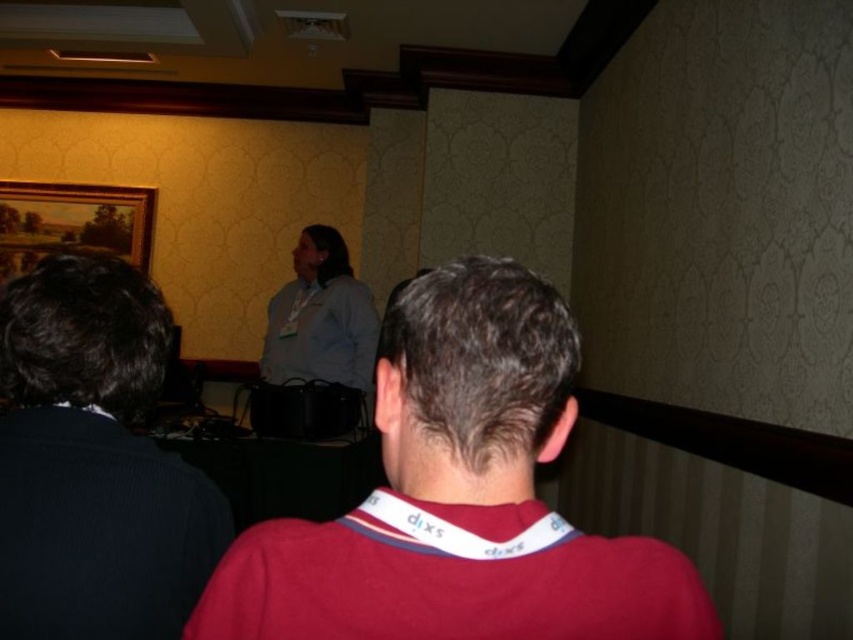
What do you see at coordinates (94, 461) in the screenshot? I see `dark blue sweater at left` at bounding box center [94, 461].

Consider the image. Measure the distance between point (103,260) and camera.

1.04 meters

Find the location of a particular element. This screenshot has width=853, height=640. dark blue sweater at left is located at coordinates (94, 461).

Does red cotton shirt at center appear on the right side of wooden oil painting at upper left?

Indeed, red cotton shirt at center is positioned on the right side of wooden oil painting at upper left.

Who is more distant from viewer, (x=676, y=588) or (x=148, y=250)?

Point (x=148, y=250)

Locate an element on the screen. red cotton shirt at center is located at coordinates (459, 497).

Between light blue shirt at center and wooden oil painting at upper left, which one is positioned higher?

Positioned higher is wooden oil painting at upper left.

Image resolution: width=853 pixels, height=640 pixels. In order to click on light blue shirt at center in this screenshot , I will do `click(321, 317)`.

Between point (316, 268) and point (16, 221), which one is positioned behind?

Point (16, 221)

Locate an element on the screen. This screenshot has height=640, width=853. light blue shirt at center is located at coordinates (321, 317).